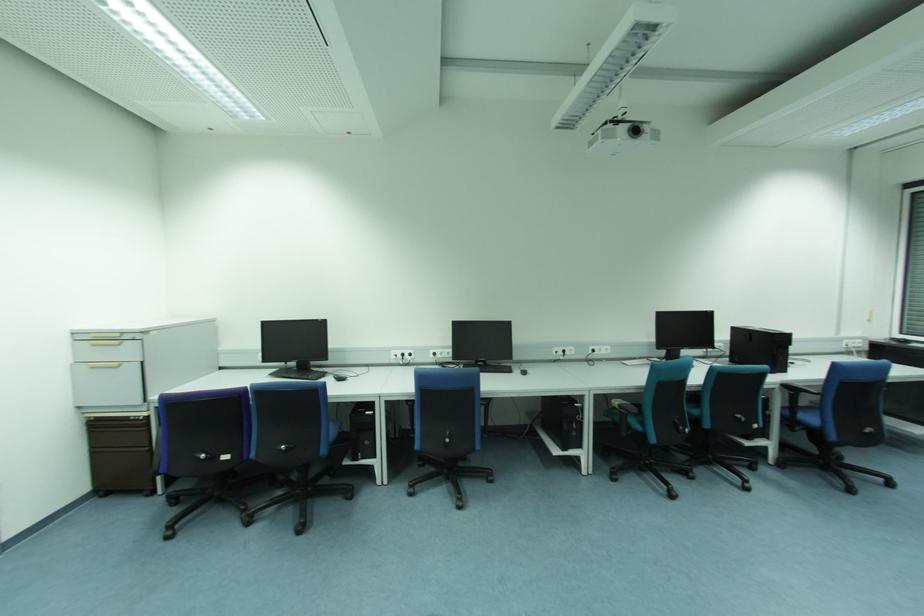
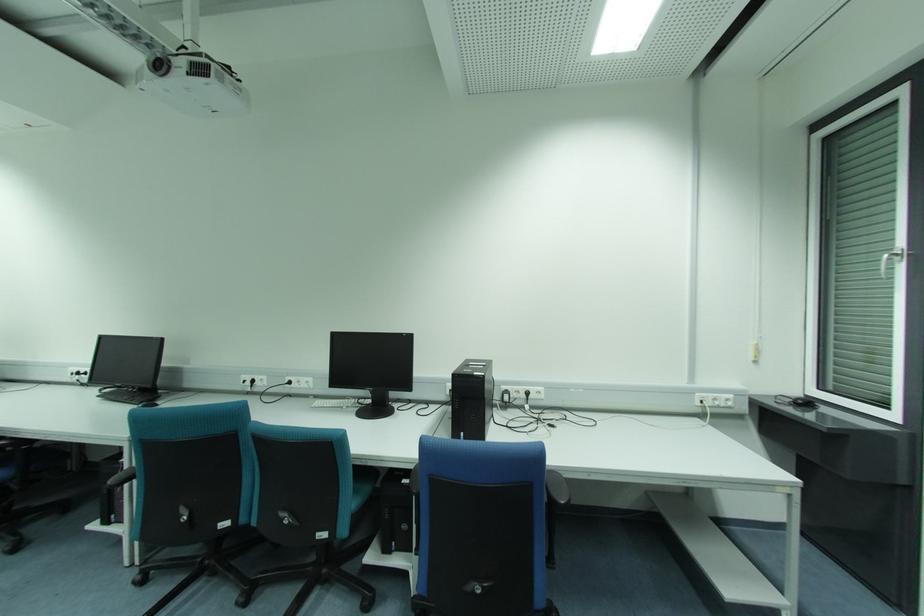
Find the pixel in the second image that matches [565,352] in the first image.

(253, 381)